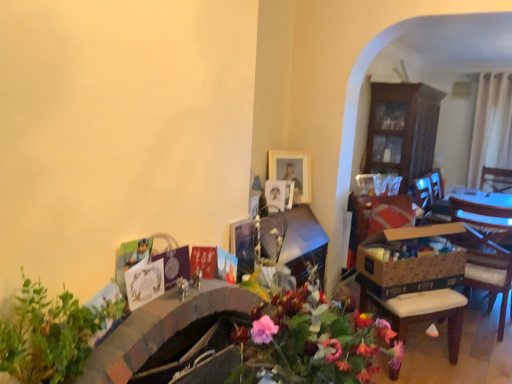
Question: Is wooden chair at right positioned with its back to wooden cabinet at right?

Choices:
 (A) yes
 (B) no

Answer: (B)

Question: Considering the relative sizes of wooden chair at right and wooden cabinet at right in the image provided, is wooden chair at right wider than wooden cabinet at right?

Choices:
 (A) no
 (B) yes

Answer: (B)

Question: From a real-world perspective, does wooden chair at right stand above wooden cabinet at right?

Choices:
 (A) yes
 (B) no

Answer: (B)

Question: Is wooden chair at right in front of wooden cabinet at right?

Choices:
 (A) no
 (B) yes

Answer: (A)

Question: Is wooden cabinet at right inside wooden chair at right?

Choices:
 (A) no
 (B) yes

Answer: (A)

Question: Is wooden cabinet at right bigger or smaller than green leafy plant at lower left?

Choices:
 (A) small
 (B) big

Answer: (B)

Question: From the image's perspective, is wooden cabinet at right positioned above or below green leafy plant at lower left?

Choices:
 (A) above
 (B) below

Answer: (A)

Question: Based on their positions, is wooden cabinet at right located to the left or right of green leafy plant at lower left?

Choices:
 (A) right
 (B) left

Answer: (A)

Question: Is point 415,165 positioned closer to the camera than point 62,297?

Choices:
 (A) closer
 (B) farther

Answer: (B)

Question: In terms of width, does green leafy plant at lower left look wider or thinner when compared to wooden picture frame at upper center?

Choices:
 (A) thin
 (B) wide

Answer: (B)

Question: Considering the positions of green leafy plant at lower left and wooden picture frame at upper center in the image, is green leafy plant at lower left taller or shorter than wooden picture frame at upper center?

Choices:
 (A) short
 (B) tall

Answer: (B)

Question: Is green leafy plant at lower left inside or outside of wooden picture frame at upper center?

Choices:
 (A) inside
 (B) outside

Answer: (B)

Question: In the image, is green leafy plant at lower left positioned in front of or behind wooden picture frame at upper center?

Choices:
 (A) front
 (B) behind

Answer: (A)

Question: Considering the relative positions of wooden picture frame at upper center and wooden chair at right in the image provided, is wooden picture frame at upper center to the left or to the right of wooden chair at right?

Choices:
 (A) right
 (B) left

Answer: (B)

Question: From a real-world perspective, relative to wooden chair at right, is wooden picture frame at upper center vertically above or below?

Choices:
 (A) below
 (B) above

Answer: (B)